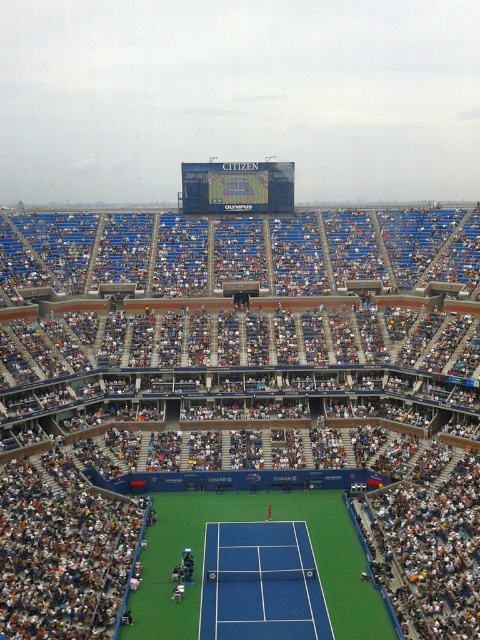
You are a tennis player preparing to serve. You notice two areas marked as blue synthetic turf tennis court at center and blue synthetic turf at center. Which area is positioned lower in the image?

The blue synthetic turf tennis court at center is positioned below the blue synthetic turf at center, so it is lower in the image.

You are a tennis player standing on the blue synthetic turf tennis court at center. You want to move to the blue synthetic turf at center. Which direction should you move in?

The blue synthetic turf tennis court at center is to the right of the blue synthetic turf at center, so you should move to the left to reach it.